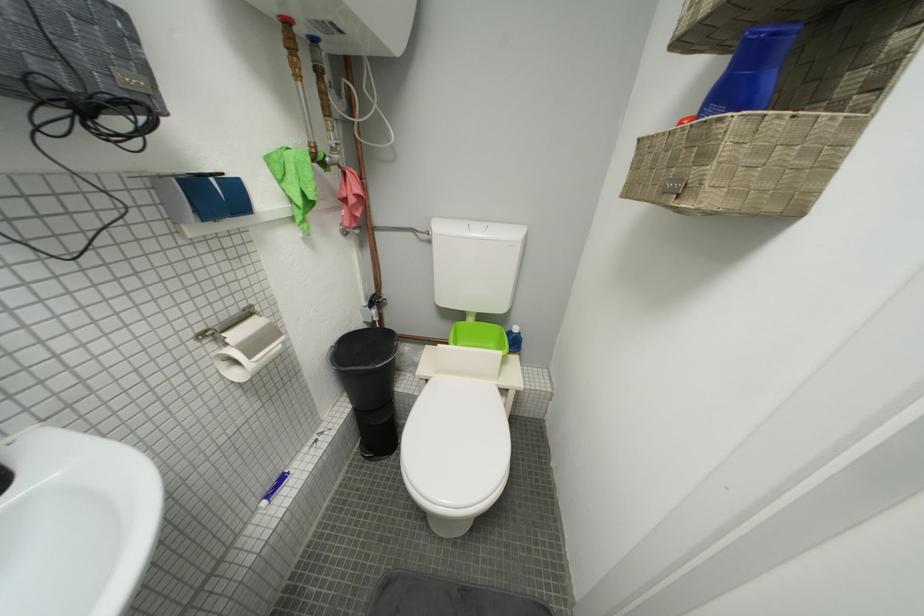
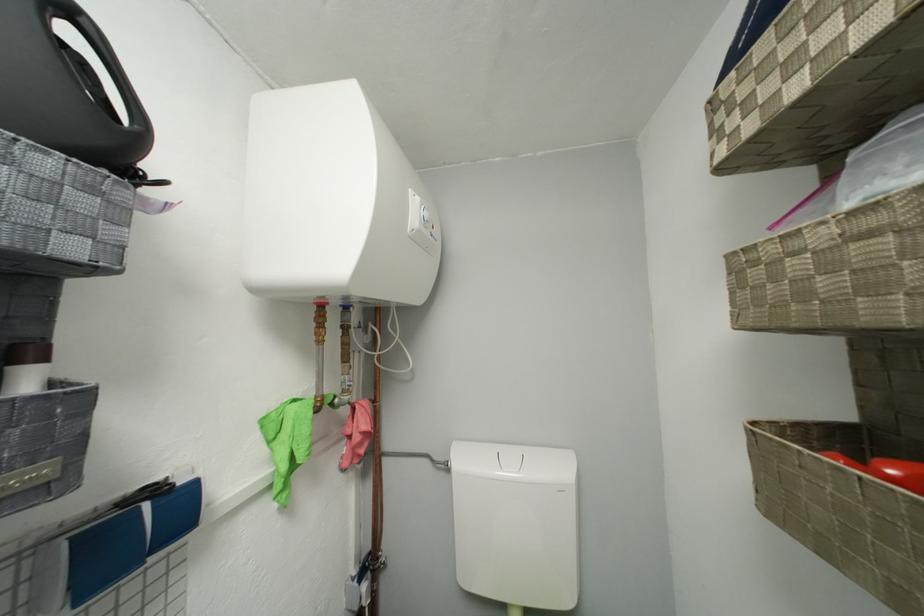
Where in the second image is the point corresponding to (x=222, y=182) from the first image?

(155, 508)